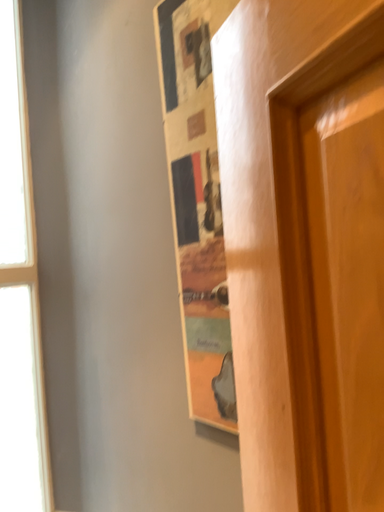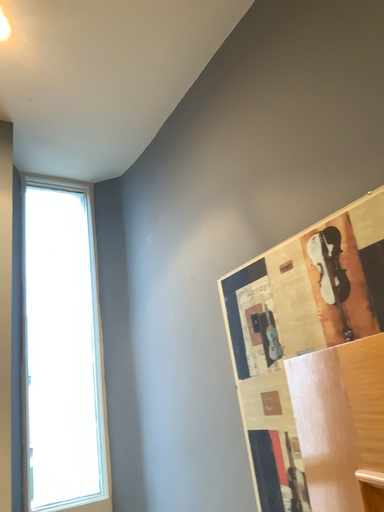
Question: Which way did the camera rotate in the video?

Choices:
 (A) rotated right
 (B) rotated left

Answer: (B)